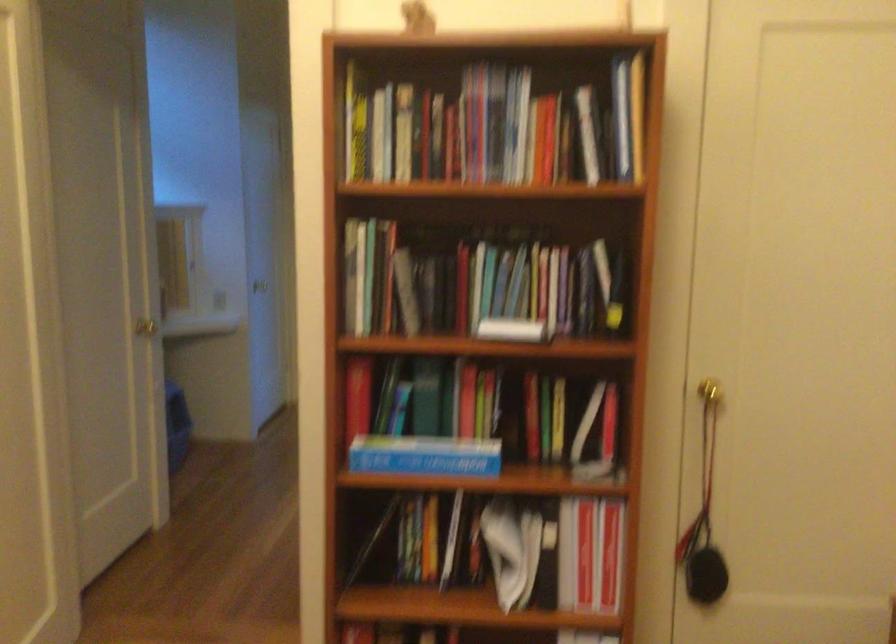
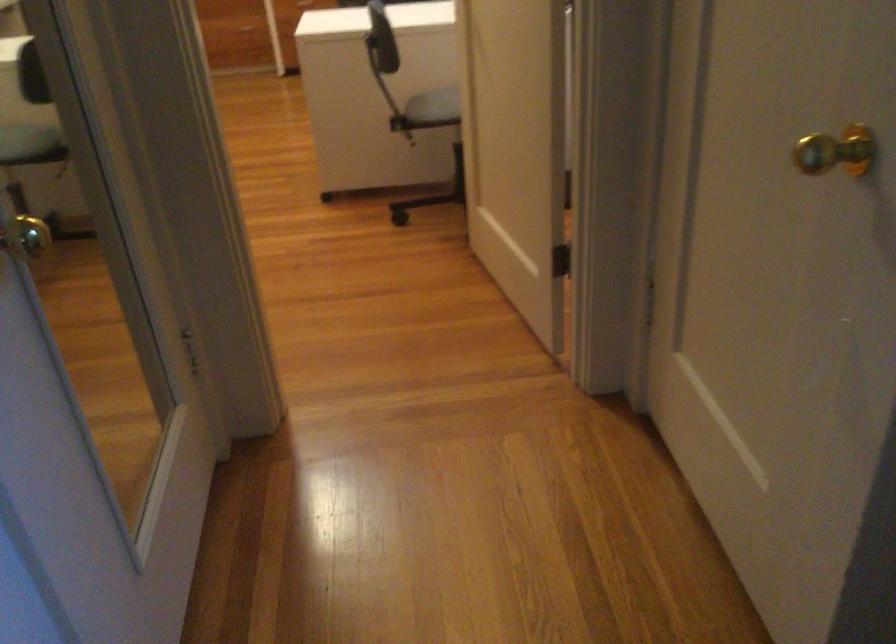
The point at (147, 332) is marked in the first image. Where is the corresponding point in the second image?

(836, 152)